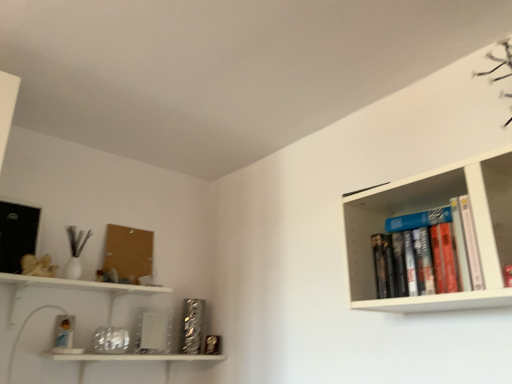
Question: Would you say corkboard at upper left is to the left or to the right of hardcover books at upper right in the picture?

Choices:
 (A) left
 (B) right

Answer: (A)

Question: Based on their sizes in the image, would you say corkboard at upper left is bigger or smaller than hardcover books at upper right?

Choices:
 (A) small
 (B) big

Answer: (A)

Question: From the image's perspective, is corkboard at upper left located above or below hardcover books at upper right?

Choices:
 (A) below
 (B) above

Answer: (A)

Question: From a real-world perspective, relative to corkboard at upper left, is hardcover books at upper right vertically above or below?

Choices:
 (A) below
 (B) above

Answer: (A)

Question: Is hardcover books at upper right wider or thinner than corkboard at upper left?

Choices:
 (A) wide
 (B) thin

Answer: (A)

Question: In terms of height, does hardcover books at upper right look taller or shorter compared to corkboard at upper left?

Choices:
 (A) short
 (B) tall

Answer: (A)

Question: In terms of size, does hardcover books at upper right appear bigger or smaller than corkboard at upper left?

Choices:
 (A) big
 (B) small

Answer: (A)